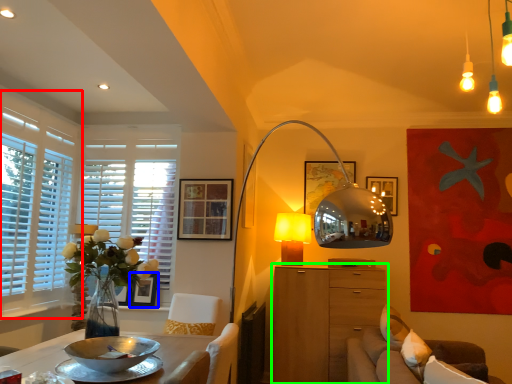
Question: Which object is the farthest from window (highlighted by a red box)? Choose among these: picture frame (highlighted by a blue box) or cabinetry (highlighted by a green box).

Choices:
 (A) picture frame
 (B) cabinetry

Answer: (B)